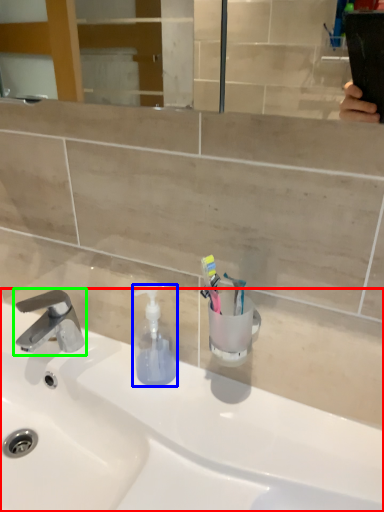
Question: Estimate the real-world distances between objects in this image. Which object is closer to sink (highlighted by a red box), soap dispenser (highlighted by a blue box) or tap (highlighted by a green box)?

Choices:
 (A) soap dispenser
 (B) tap

Answer: (A)